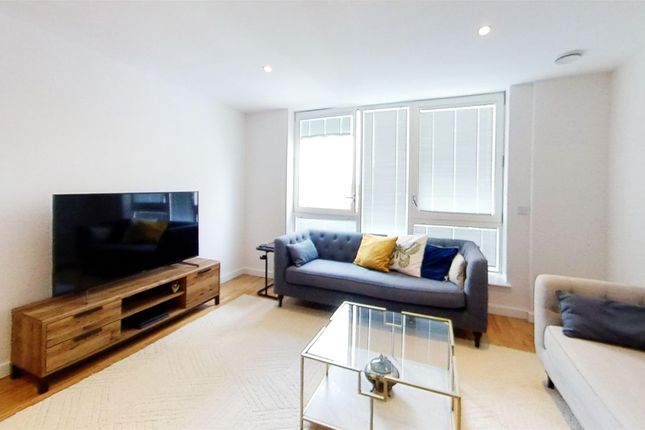
Find the location of a particular element. television is located at coordinates (100, 238).